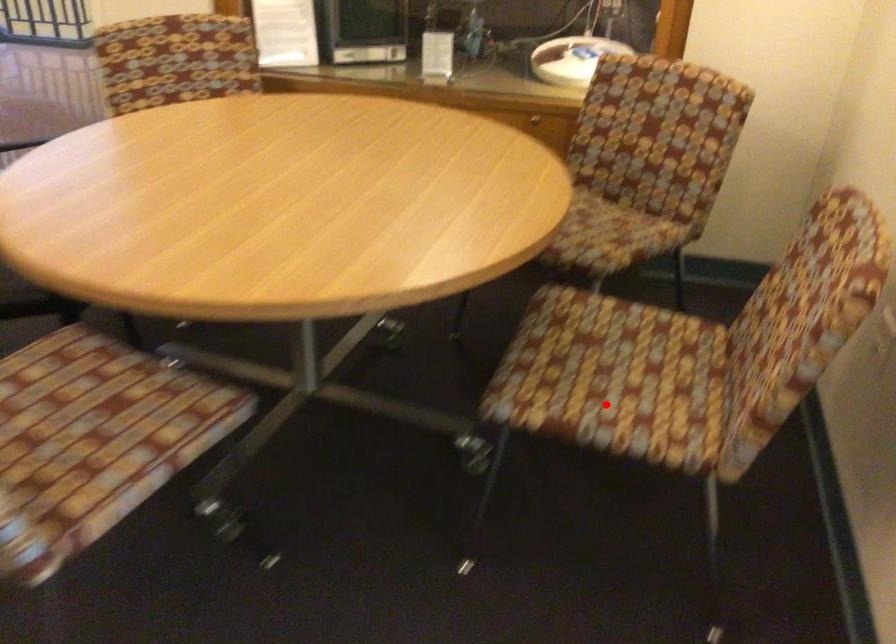
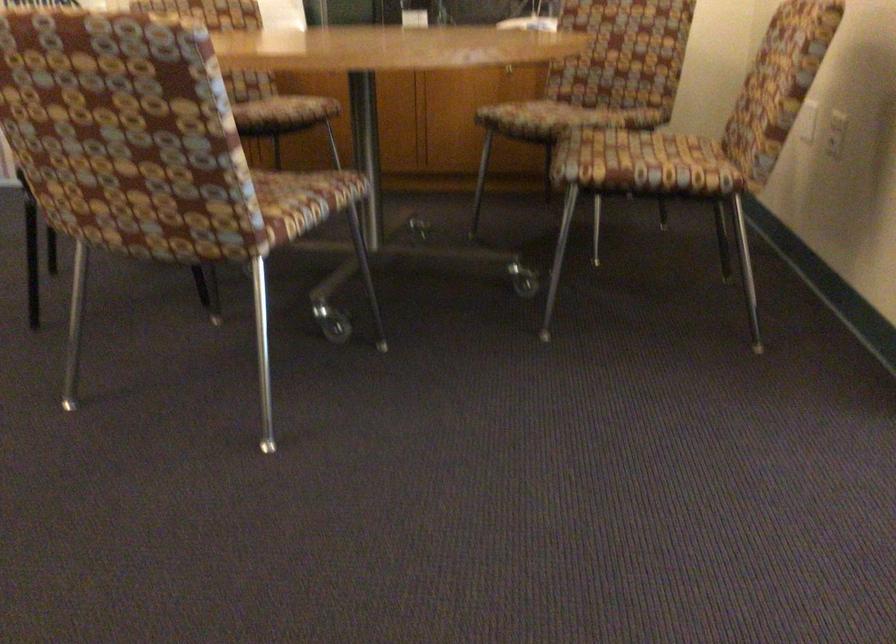
Question: I am providing you with two images of the same scene from different viewpoints. Given a red point in image1, look at the same physical point in image2. Is it:

Choices:
 (A) Closer to the viewpoint
 (B) Farther from the viewpoint

Answer: (B)